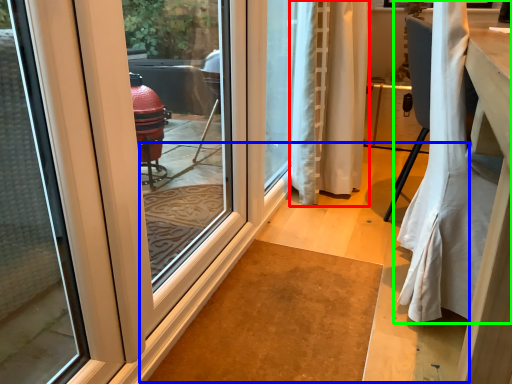
Question: Which is farther away from curtain (highlighted by a red box)? path (highlighted by a blue box) or curtain (highlighted by a green box)?

Choices:
 (A) path
 (B) curtain

Answer: (B)